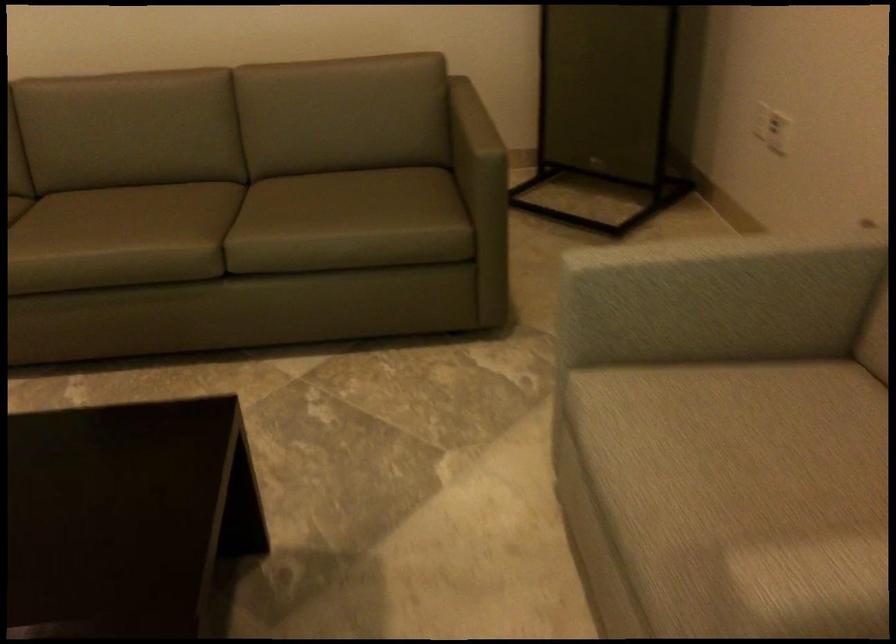
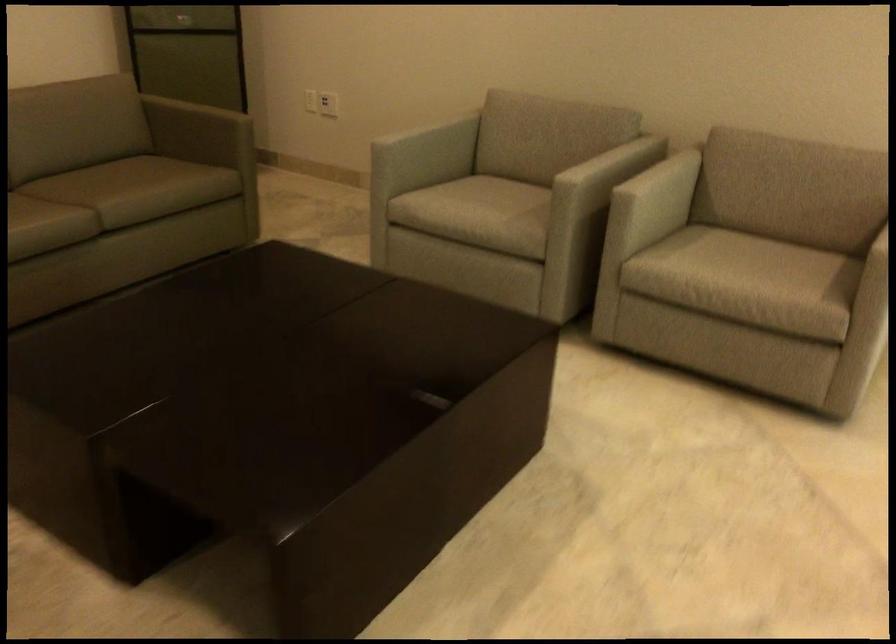
The point at (755, 263) is marked in the first image. Where is the corresponding point in the second image?

(423, 127)